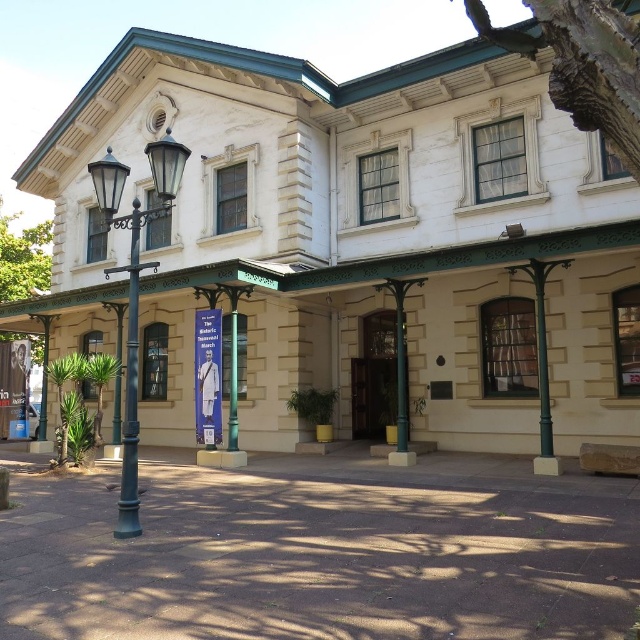
Is point (524, 289) less distant than point (125, 524)?

No, (524, 289) is behind (125, 524).

Who is taller, beige stone building at center or polished metal streetlamp at left?

With more height is beige stone building at center.

Which is behind, point (212, 90) or point (132, 369)?

Positioned behind is point (212, 90).

Where is `beige stone building at center`? The width and height of the screenshot is (640, 640). beige stone building at center is located at coordinates (356, 241).

Who is taller, beige stone building at center or green metal/texture pillar at center?

beige stone building at center

Can you confirm if beige stone building at center is smaller than green metal/texture pillar at center?

Incorrect, beige stone building at center is not smaller in size than green metal/texture pillar at center.

Who is more forward, (572,296) or (385,284)?

Point (385,284) is more forward.

Locate an element on the screen. This screenshot has width=640, height=640. beige stone building at center is located at coordinates (356, 241).

Does green metal/texture lamp post at left have a lesser width compared to green metal/texture pillar at center?

Incorrect, green metal/texture lamp post at left's width is not less than green metal/texture pillar at center's.

Is green metal/texture lamp post at left in front of green metal/texture pillar at center?

Yes, green metal/texture lamp post at left is in front of green metal/texture pillar at center.

Find the location of `green metal/texture lamp post at left`. green metal/texture lamp post at left is located at coordinates (x=134, y=289).